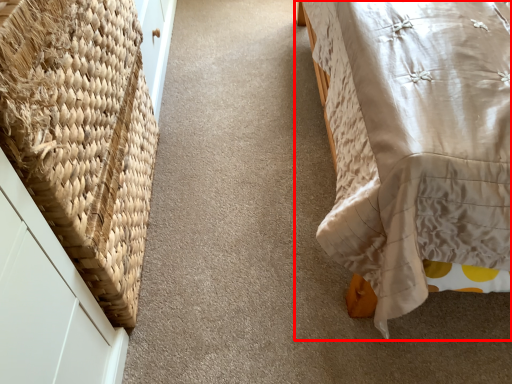
Question: From the image, what is the correct spatial relationship of furniture (annotated by the red box) in relation to basket?

Choices:
 (A) right
 (B) left

Answer: (A)